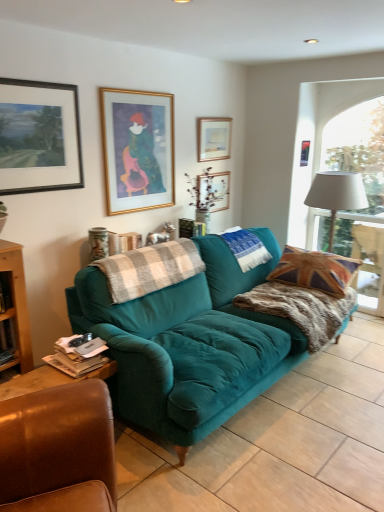
Question: Looking at their shapes, would you say fuzzy brown blanket at right, which ranks as the first blanket in right-to-left order, is wider or thinner than white fabric lampshade at right?

Choices:
 (A) wide
 (B) thin

Answer: (A)

Question: Considering the positions of fuzzy brown blanket at right, which ranks as the first blanket in right-to-left order, and white fabric lampshade at right in the image, is fuzzy brown blanket at right, which ranks as the first blanket in right-to-left order, taller or shorter than white fabric lampshade at right?

Choices:
 (A) short
 (B) tall

Answer: (A)

Question: Estimate the real-world distances between objects in this image. Which object is closer to the white fabric lampshade at right?

Choices:
 (A) plaid wool blanket at center, which is counted as the first blanket, starting from the left
 (B) gold-framed picture at upper center, which ranks as the 4th picture frame in right-to-left order
 (C) knitted woolen blanket at center, the 2th blanket when ordered from left to right
 (D) white fabric lampshade at right
 (E) teal velvet sofa at center

Answer: (C)

Question: Estimate the real-world distances between objects in this image. Which object is closer to the teal velvet sofa at center?

Choices:
 (A) gold-framed picture at upper center, the 5th picture frame positioned from the left
 (B) matte black picture frame at upper left, acting as the 1th picture frame starting from the left
 (C) gold-framed picture at upper center, arranged as the 2th picture frame when viewed from the left
 (D) matte white picture frame at upper center, placed as the 3th picture frame when sorted from left to right
 (E) fuzzy brown blanket at right, arranged as the third blanket when viewed from the left

Answer: (E)